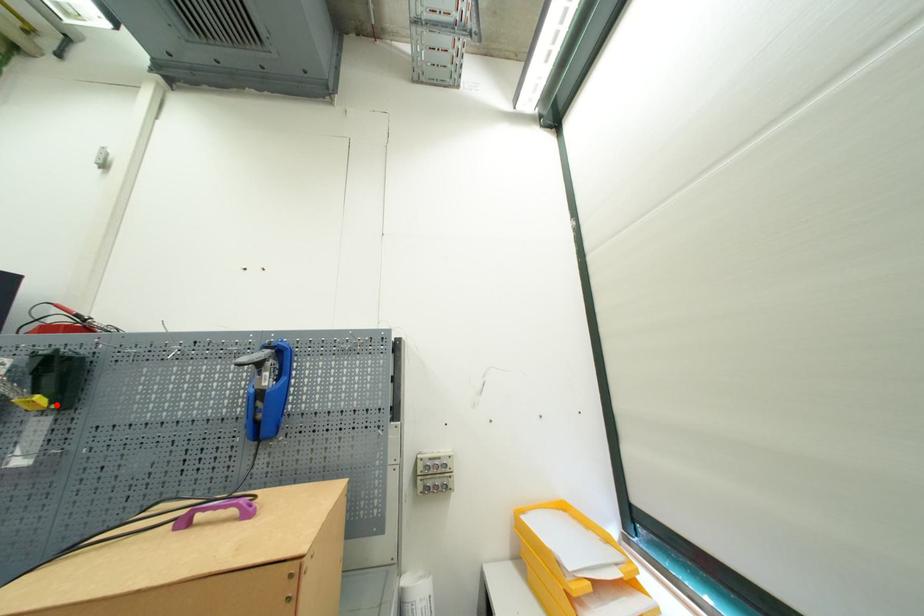
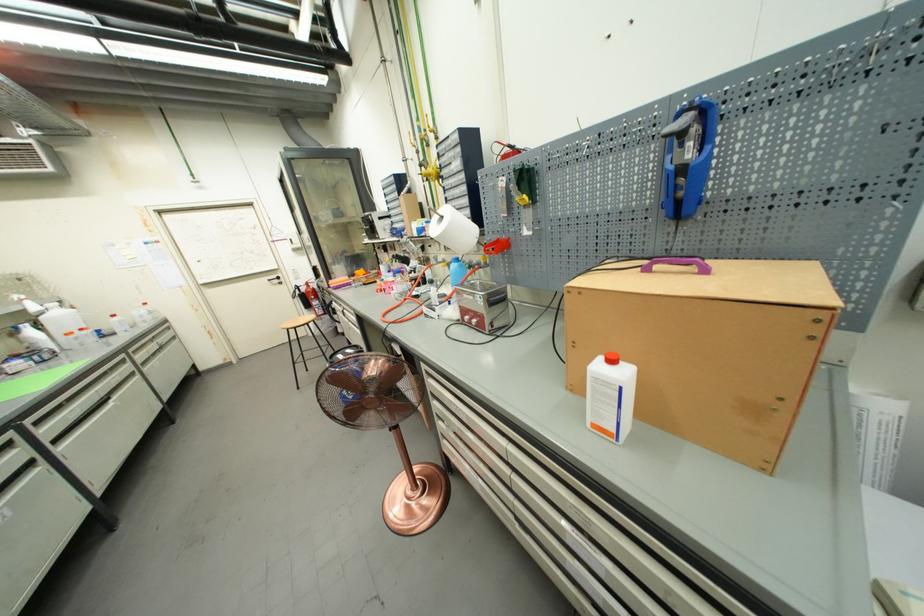
The point at the highlighted location is marked in the first image. Where is the corresponding point in the second image?

(535, 201)